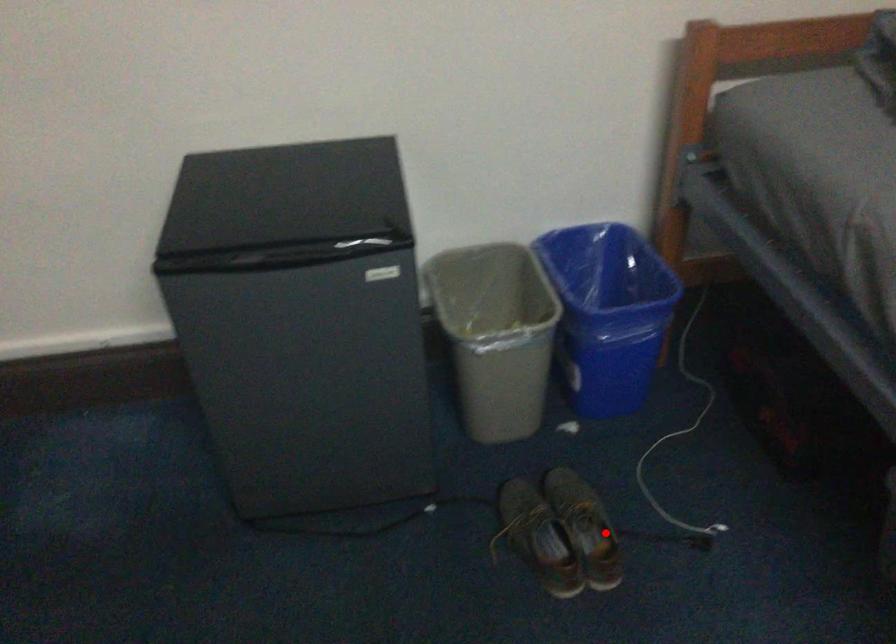
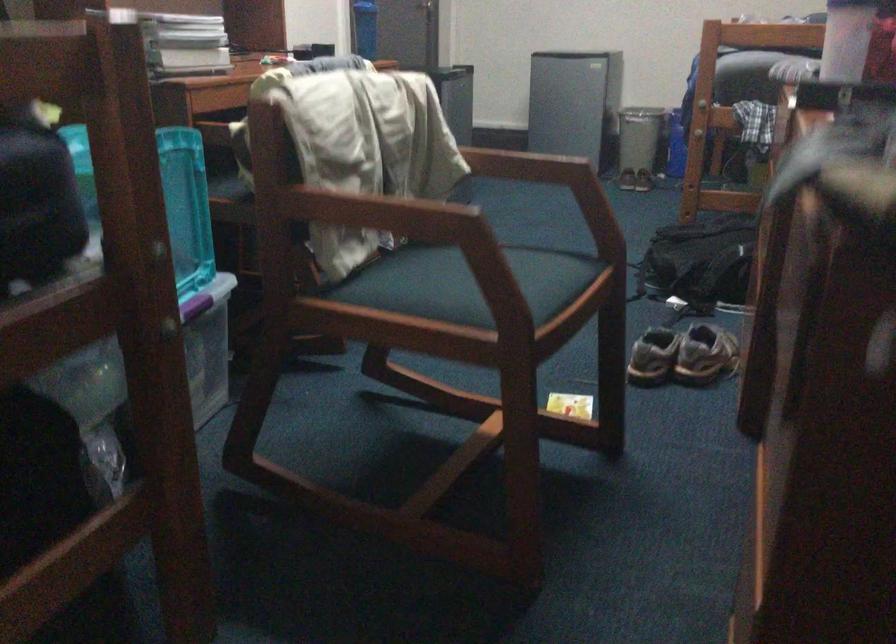
Locate, in the second image, the point that corresponds to the highlighted location in the first image.

(638, 146)